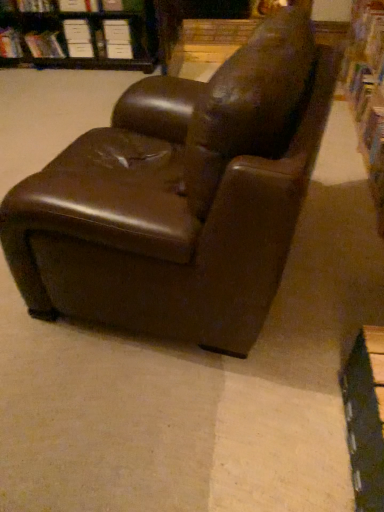
Question: From the image's perspective, does hardcover book at upper left, the 1th book when ordered from top to bottom, appear higher than white paper at upper center, which is counted as the 4th paperback book, starting from the left?

Choices:
 (A) yes
 (B) no

Answer: (A)

Question: Considering the relative sizes of hardcover book at upper left, which is the third book from left to right, and white paper at upper center, which is the first paperback book from right to left, in the image provided, is hardcover book at upper left, which is the third book from left to right, bigger than white paper at upper center, which is the first paperback book from right to left,?

Choices:
 (A) no
 (B) yes

Answer: (B)

Question: Considering the relative sizes of hardcover book at upper left, arranged as the third book when viewed from the back, and white paper at upper center, which is counted as the 4th paperback book, starting from the left, in the image provided, is hardcover book at upper left, arranged as the third book when viewed from the back, taller than white paper at upper center, which is counted as the 4th paperback book, starting from the left,?

Choices:
 (A) yes
 (B) no

Answer: (B)

Question: Considering the relative sizes of hardcover book at upper left, the 1th book when ordered from top to bottom, and white paper at upper center, which is counted as the 4th paperback book, starting from the left, in the image provided, is hardcover book at upper left, the 1th book when ordered from top to bottom, wider than white paper at upper center, which is counted as the 4th paperback book, starting from the left,?

Choices:
 (A) yes
 (B) no

Answer: (A)

Question: Is white paper at upper center, which is the first paperback book from right to left, completely or partially inside hardcover book at upper left, arranged as the third book when viewed from the back?

Choices:
 (A) no
 (B) yes

Answer: (A)

Question: Considering their positions, is white paper at upper center, which is counted as the 4th paperback book, starting from the left, located in front of or behind white paper at upper left, positioned as the 3th paperback book in right-to-left order?

Choices:
 (A) behind
 (B) front

Answer: (B)

Question: Looking at the image, does white paper at upper center, which is the first paperback book from right to left, seem bigger or smaller compared to white paper at upper left, positioned as the 3th paperback book in right-to-left order?

Choices:
 (A) small
 (B) big

Answer: (B)

Question: Is white paper at upper center, which is the first paperback book from right to left, taller or shorter than white paper at upper left, positioned as the 3th paperback book in right-to-left order?

Choices:
 (A) short
 (B) tall

Answer: (B)

Question: Would you say white paper at upper center, which is counted as the 4th paperback book, starting from the left, is inside or outside white paper at upper left, positioned as the 3th paperback book in right-to-left order?

Choices:
 (A) outside
 (B) inside

Answer: (A)

Question: In the image, is hardcover book at upper left, which appears as the 2th book when viewed from the left, positioned in front of or behind white paper book at upper left, marked as the third book in a bottom-to-top arrangement?

Choices:
 (A) behind
 (B) front

Answer: (B)

Question: Does point (38, 45) appear closer or farther from the camera than point (14, 50)?

Choices:
 (A) farther
 (B) closer

Answer: (B)

Question: Looking at their shapes, would you say hardcover book at upper left, which is the third book from right to left, is wider or thinner than white paper book at upper left, which is counted as the second book, starting from the top?

Choices:
 (A) thin
 (B) wide

Answer: (A)

Question: From the image's perspective, is hardcover book at upper left, positioned as the 2th book in back-to-front order, located above or below white paper book at upper left, which is counted as the second book, starting from the top?

Choices:
 (A) above
 (B) below

Answer: (B)

Question: Considering the positions of hardcover book at upper left, which is the third book from left to right, and hardcover book at upper right, the 1th book in the bottom-to-top sequence, in the image, is hardcover book at upper left, which is the third book from left to right, bigger or smaller than hardcover book at upper right, the 1th book in the bottom-to-top sequence,?

Choices:
 (A) big
 (B) small

Answer: (B)

Question: From the image's perspective, relative to hardcover book at upper right, which is the 4th book from top to bottom, is hardcover book at upper left, which appears as the second book when viewed from the front, above or below?

Choices:
 (A) above
 (B) below

Answer: (A)